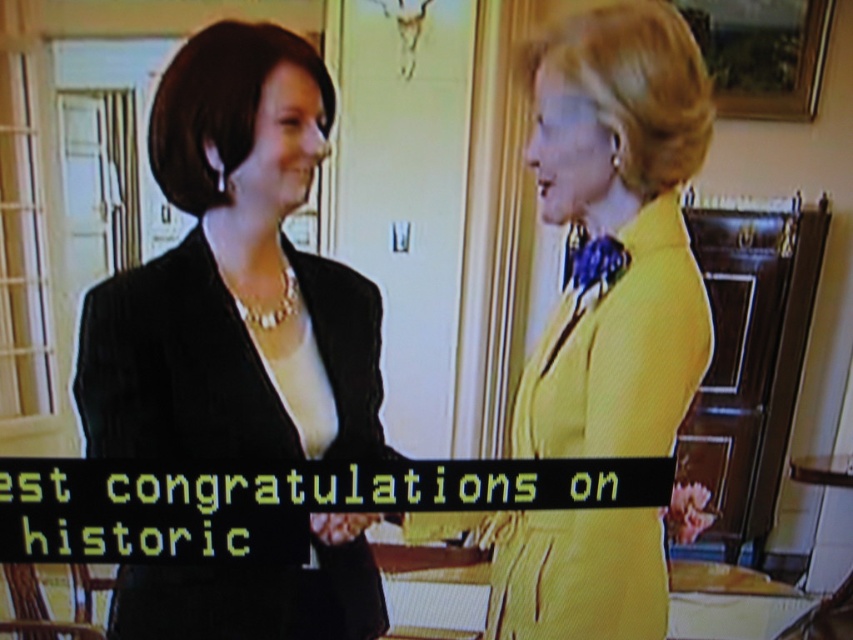
Question: In this image, where is matte black blazer at center located relative to yellow textured dress at right?

Choices:
 (A) below
 (B) above

Answer: (B)

Question: Is matte black blazer at center above yellow textured dress at right?

Choices:
 (A) no
 (B) yes

Answer: (B)

Question: Is matte black blazer at center below yellow textured dress at right?

Choices:
 (A) yes
 (B) no

Answer: (B)